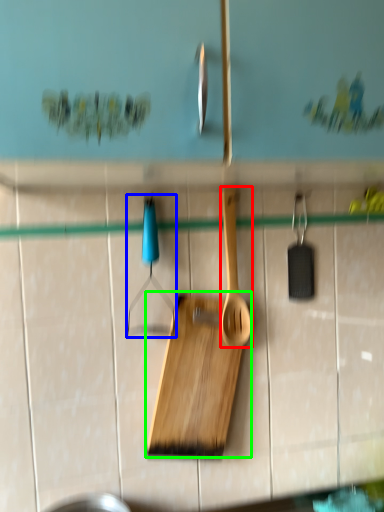
Question: Based on their relative distances, which object is nearer to spatula (highlighted by a red box)? Choose from hanger (highlighted by a blue box) and cutting board (highlighted by a green box).

Choices:
 (A) hanger
 (B) cutting board

Answer: (B)